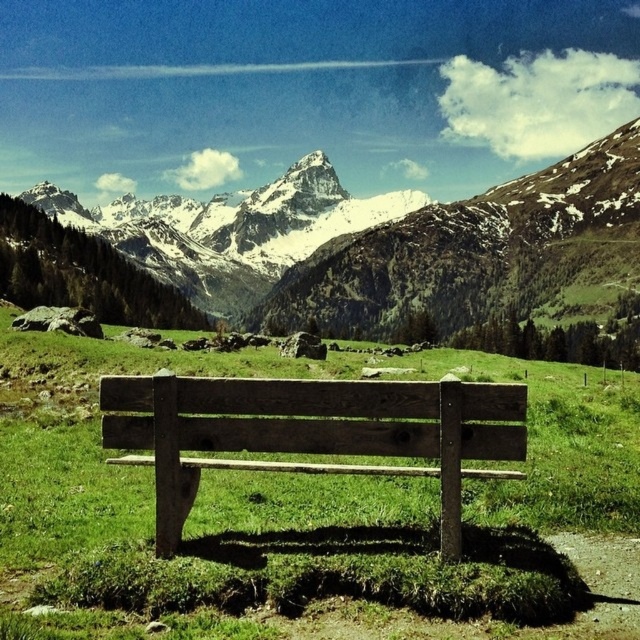
Question: Is snowy granite mountain range at upper center behind weathered wood bench at center?

Choices:
 (A) yes
 (B) no

Answer: (A)

Question: Which object is farther from the camera taking this photo?

Choices:
 (A) weathered wood bench at center
 (B) snowy granite mountain range at upper center

Answer: (B)

Question: Is snowy granite mountain range at upper center closer to the viewer compared to weathered wood bench at center?

Choices:
 (A) yes
 (B) no

Answer: (B)

Question: Which point appears farthest from the camera in this image?

Choices:
 (A) (387, 449)
 (B) (264, 196)

Answer: (B)

Question: Does snowy granite mountain range at upper center come in front of weathered wood bench at center?

Choices:
 (A) yes
 (B) no

Answer: (B)

Question: Which object appears closest to the camera in this image?

Choices:
 (A) weathered wood bench at center
 (B) snowy granite mountain range at upper center

Answer: (A)